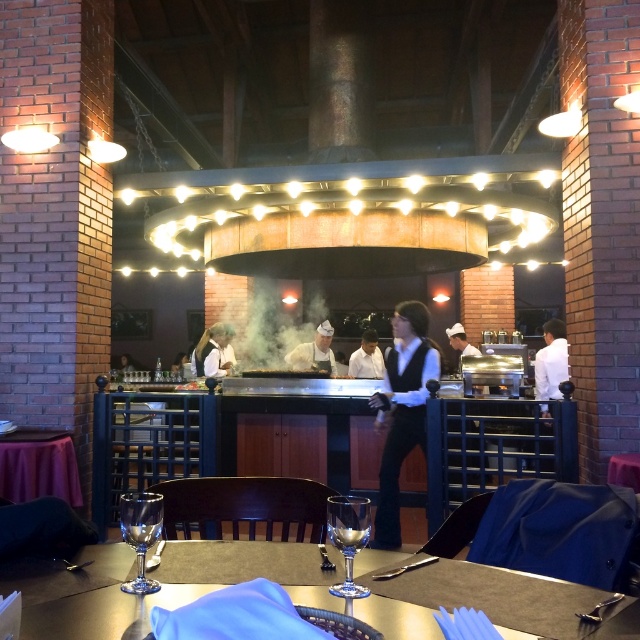
Question: Which point is farther to the camera?

Choices:
 (A) (372, 348)
 (B) (454, 333)
 (C) (26, 477)
 (D) (424, 595)

Answer: (B)

Question: Is matte black vest at center to the right of transparent glass at center from the viewer's perspective?

Choices:
 (A) no
 (B) yes

Answer: (B)

Question: Which object appears closest to the camera in this image?

Choices:
 (A) white glossy chef hat at center
 (B) clear glass wine glass at lower left
 (C) shiny glassware at center

Answer: (C)

Question: Can you confirm if white glossy chef hat at center is wider than white shirt at center?

Choices:
 (A) no
 (B) yes

Answer: (B)

Question: Estimate the real-world distances between objects in this image. Which object is closer to the white shirt at center?

Choices:
 (A) smoketransparentsteam at center
 (B) transparent glass at center
 (C) matte black vest at center
 (D) white chef hat at center

Answer: (D)

Question: Can you confirm if purple fabric table at lower left is positioned above clear glass wine glass at lower left?

Choices:
 (A) yes
 (B) no

Answer: (B)